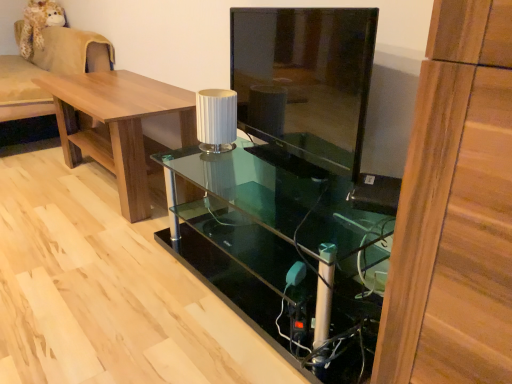
Question: Considering the relative sizes of beige fabric couch at left and brown wood table at left in the image provided, is beige fabric couch at left shorter than brown wood table at left?

Choices:
 (A) no
 (B) yes

Answer: (A)

Question: From the image's perspective, is beige fabric couch at left beneath brown wood table at left?

Choices:
 (A) no
 (B) yes

Answer: (A)

Question: Considering the relative positions of beige fabric couch at left and brown wood table at left in the image provided, is beige fabric couch at left in front of brown wood table at left?

Choices:
 (A) yes
 (B) no

Answer: (B)

Question: Can you confirm if beige fabric couch at left is taller than brown wood table at left?

Choices:
 (A) no
 (B) yes

Answer: (B)

Question: Can we say beige fabric couch at left lies outside brown wood table at left?

Choices:
 (A) no
 (B) yes

Answer: (B)

Question: Relative to brown wood table at left, is transparent glass tv stand at center in front or behind?

Choices:
 (A) behind
 (B) front

Answer: (B)

Question: Visually, is transparent glass tv stand at center positioned to the left or to the right of brown wood table at left?

Choices:
 (A) right
 (B) left

Answer: (A)

Question: Is transparent glass tv stand at center bigger or smaller than brown wood table at left?

Choices:
 (A) big
 (B) small

Answer: (B)

Question: From a real-world perspective, is transparent glass tv stand at center above or below brown wood table at left?

Choices:
 (A) above
 (B) below

Answer: (A)

Question: In terms of width, does transparent glass tv stand at center look wider or thinner when compared to transparent glass desk at center?

Choices:
 (A) wide
 (B) thin

Answer: (B)

Question: Would you say transparent glass tv stand at center is to the left or to the right of transparent glass desk at center in the picture?

Choices:
 (A) left
 (B) right

Answer: (B)

Question: Considering the positions of transparent glass tv stand at center and transparent glass desk at center in the image, is transparent glass tv stand at center bigger or smaller than transparent glass desk at center?

Choices:
 (A) big
 (B) small

Answer: (B)

Question: Relative to transparent glass desk at center, is transparent glass tv stand at center in front or behind?

Choices:
 (A) front
 (B) behind

Answer: (B)

Question: In terms of width, does transparent glass desk at center look wider or thinner when compared to white ribbed lampshade at center?

Choices:
 (A) wide
 (B) thin

Answer: (A)

Question: From a real-world perspective, relative to white ribbed lampshade at center, is transparent glass desk at center vertically above or below?

Choices:
 (A) above
 (B) below

Answer: (B)